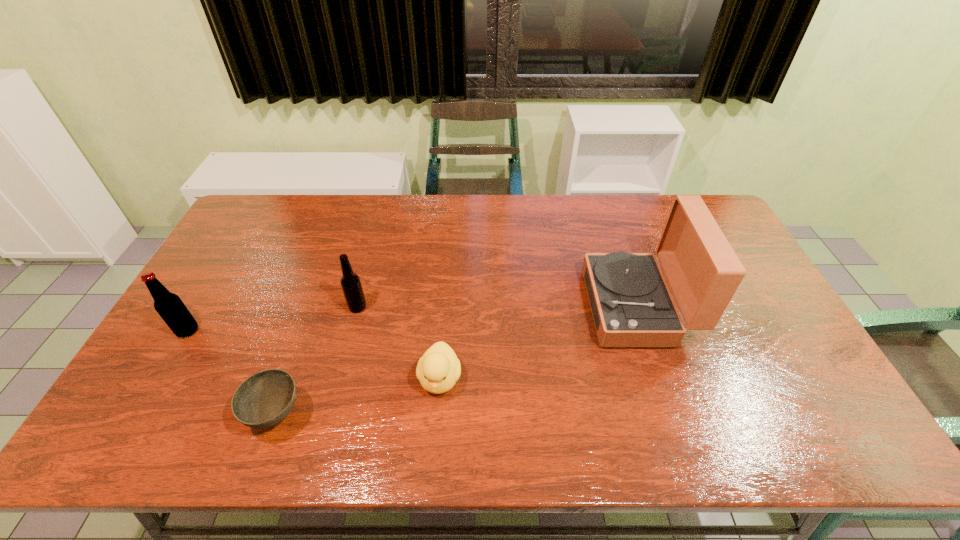
You are a GUI agent. You are given a task and a screenshot of the screen. Output one action in this format:
    pyautogui.click(x=<x>, y=<y>)
    Task: Click on the blank space at the near edge of the desktop
    This screenshot has height=540, width=960.
    Given the screenshot: What is the action you would take?
    pyautogui.click(x=711, y=428)

I want to click on vacant area at the left edge of the desktop, so (262, 244).

Image resolution: width=960 pixels, height=540 pixels. I want to click on blank space at the right edge of the desktop, so click(776, 364).

The height and width of the screenshot is (540, 960). Find the location of `free point at the far right corner`. free point at the far right corner is located at coordinates (708, 206).

The image size is (960, 540). In order to click on empty space that is in between the leftmost object and the fourth object from left to right in this screenshot , I will do `click(314, 355)`.

At what (x,y) coordinates should I click in order to perform the action: click on vacant space in between the duck and the phonograph record. Please return your answer as a coordinate pair (x, y). Image resolution: width=960 pixels, height=540 pixels. Looking at the image, I should click on (538, 342).

The width and height of the screenshot is (960, 540). I want to click on free space between the second shortest object and the farther beer bottle, so click(x=398, y=343).

Where is `vacant area that lies between the duck and the nearer beer bottle`? The height and width of the screenshot is (540, 960). vacant area that lies between the duck and the nearer beer bottle is located at coordinates (314, 355).

Locate an element on the screen. The height and width of the screenshot is (540, 960). vacant space in between the third object from left to right and the duck is located at coordinates (398, 343).

Identify the location of vacant space that is in between the fourth tallest object and the phonograph record. The image size is (960, 540). (538, 342).